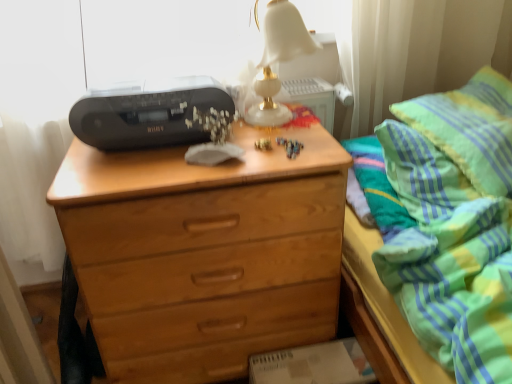
Question: Does green striped pillow at upper right appear on the left side of white marble table lamp at upper center?

Choices:
 (A) yes
 (B) no

Answer: (B)

Question: Considering the relative sizes of green striped pillow at upper right and white marble table lamp at upper center in the image provided, is green striped pillow at upper right thinner than white marble table lamp at upper center?

Choices:
 (A) yes
 (B) no

Answer: (B)

Question: Is green striped pillow at upper right turned away from white marble table lamp at upper center?

Choices:
 (A) yes
 (B) no

Answer: (B)

Question: Is green striped pillow at upper right further to the viewer compared to white marble table lamp at upper center?

Choices:
 (A) no
 (B) yes

Answer: (A)

Question: Is there a large distance between green striped pillow at upper right and white marble table lamp at upper center?

Choices:
 (A) no
 (B) yes

Answer: (A)

Question: Is green striped pillow at upper right at the right side of white marble table lamp at upper center?

Choices:
 (A) yes
 (B) no

Answer: (A)

Question: Does light brown wood chest of drawers at center have a greater height compared to green striped fabric at upper right?

Choices:
 (A) yes
 (B) no

Answer: (B)

Question: Considering the relative sizes of light brown wood chest of drawers at center and green striped fabric at upper right in the image provided, is light brown wood chest of drawers at center thinner than green striped fabric at upper right?

Choices:
 (A) no
 (B) yes

Answer: (B)

Question: Is green striped fabric at upper right completely or partially inside light brown wood chest of drawers at center?

Choices:
 (A) no
 (B) yes

Answer: (A)

Question: From the image's perspective, is light brown wood chest of drawers at center under green striped fabric at upper right?

Choices:
 (A) no
 (B) yes

Answer: (B)

Question: Are light brown wood chest of drawers at center and green striped fabric at upper right making contact?

Choices:
 (A) yes
 (B) no

Answer: (B)

Question: Is light brown wood chest of drawers at center bigger than green striped fabric at upper right?

Choices:
 (A) no
 (B) yes

Answer: (A)

Question: Can you confirm if black plastic printer at upper left is positioned to the left of white marble table lamp at upper center?

Choices:
 (A) yes
 (B) no

Answer: (A)